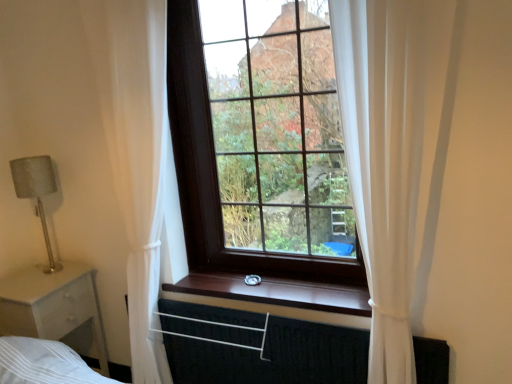
Where is `empty space that is ontop of wooden at center (from a real-world perspective)`? This screenshot has height=384, width=512. empty space that is ontop of wooden at center (from a real-world perspective) is located at coordinates (x=276, y=290).